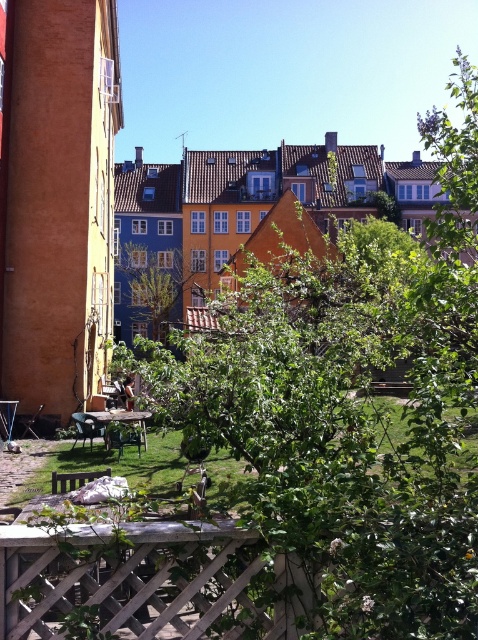
Who is taller, wooden lattice at lower center or green leafy tree at center?

With more height is green leafy tree at center.

You are a GUI agent. You are given a task and a screenshot of the screen. Output one action in this format:
    pyautogui.click(x=<x>, y=<y>)
    Task: Click on the wooden lattice at lower center
    
    Given the screenshot: What is the action you would take?
    pyautogui.click(x=152, y=582)

Image resolution: width=478 pixels, height=640 pixels. Identify the location of wooden lattice at lower center. (152, 582).